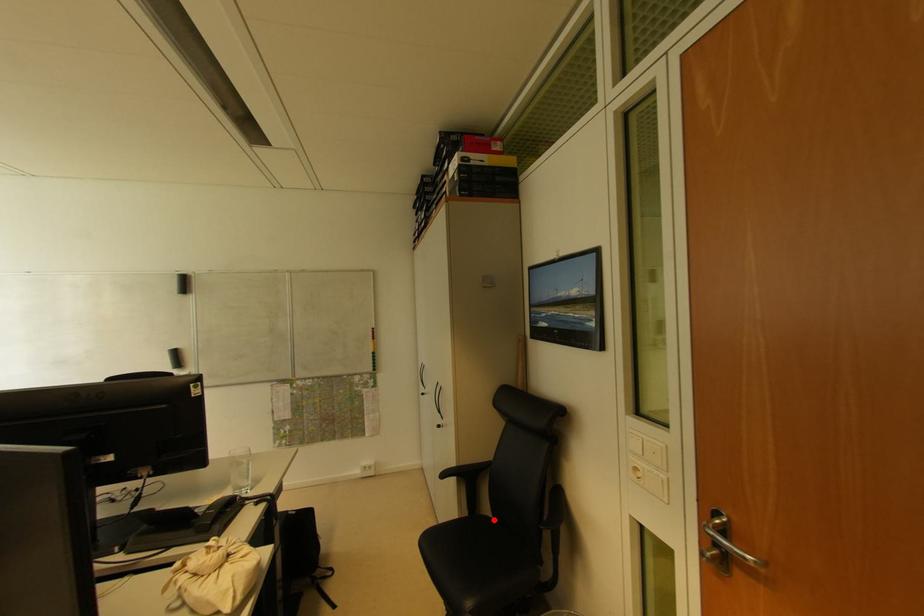
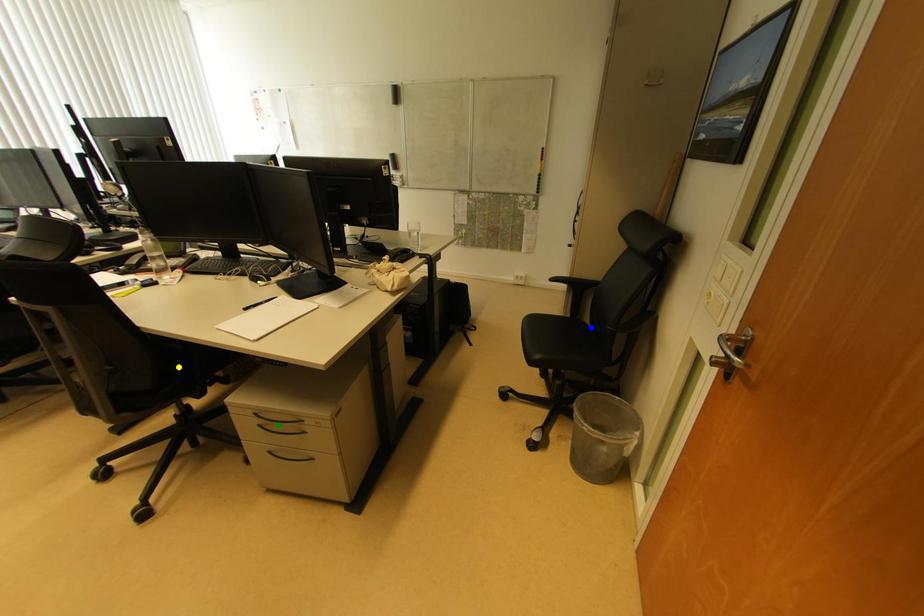
Question: I am providing you with two images of the same scene from different viewpoints. A red point is marked on the first image. You are given multiple points on the second image. Can you choose the point in image 2 that corresponds to the point in image 1?

Choices:
 (A) yellow point
 (B) blue point
 (C) green point

Answer: (B)